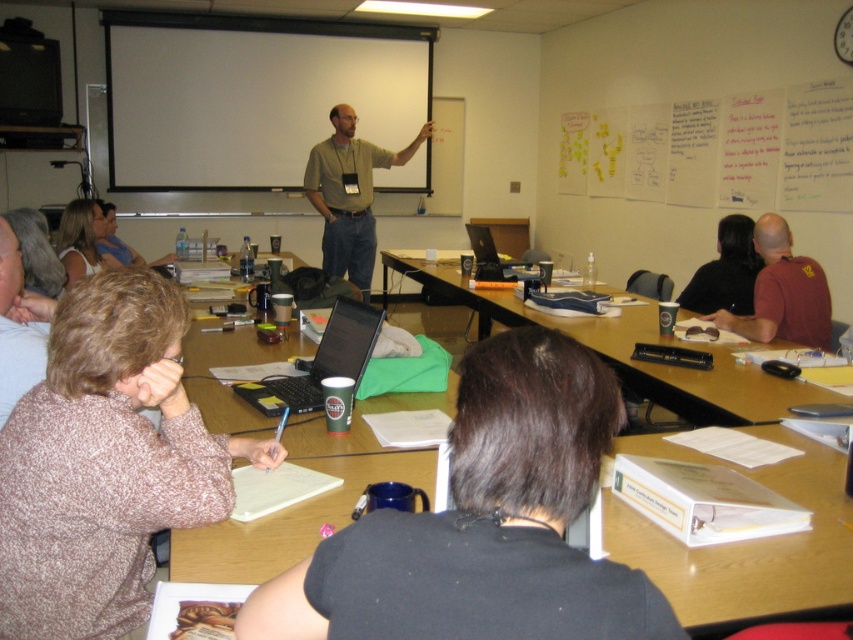
In the classroom scene, there is a brown leather shirt at right and a black plastic laptop at center. Which object is positioned to the right of the other?

The brown leather shirt at right is to the right of the black plastic laptop at center.

You are standing at the back of the classroom and want to hand a document to the person wearing the matte white blouse at upper left. If your maximum reaching distance is 3 meters, can you reach them without moving closer?

The matte white blouse at upper left is 3.36 meters away from the viewer. Since your maximum reaching distance is 3 meters, you cannot reach them without moving closer.